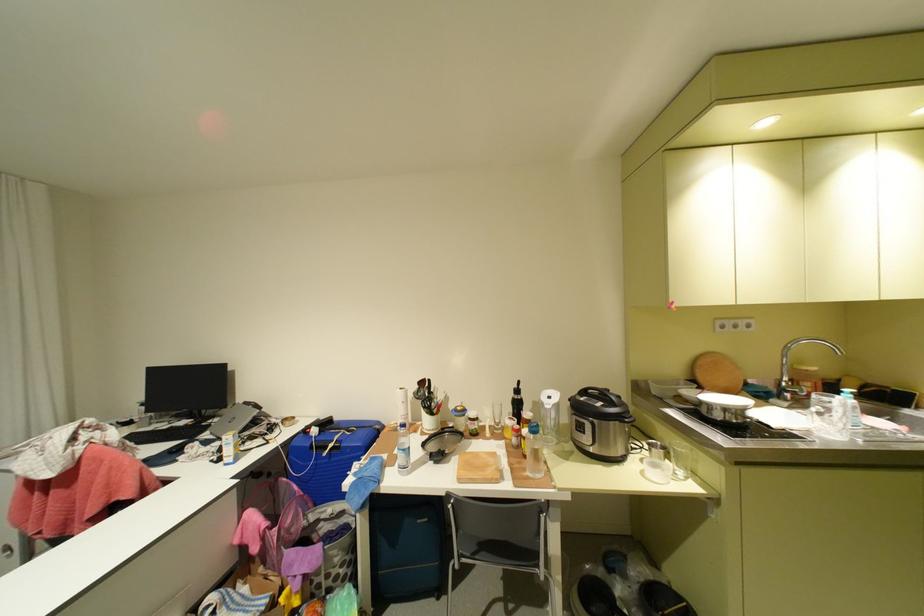
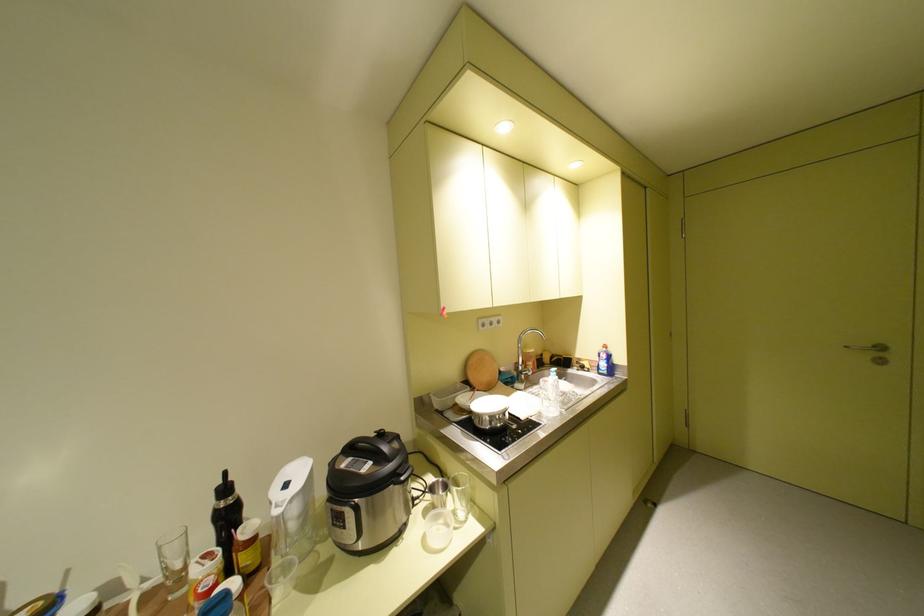
Locate, in the second image, the point that corresponds to (810,411) in the first image.

(541, 390)